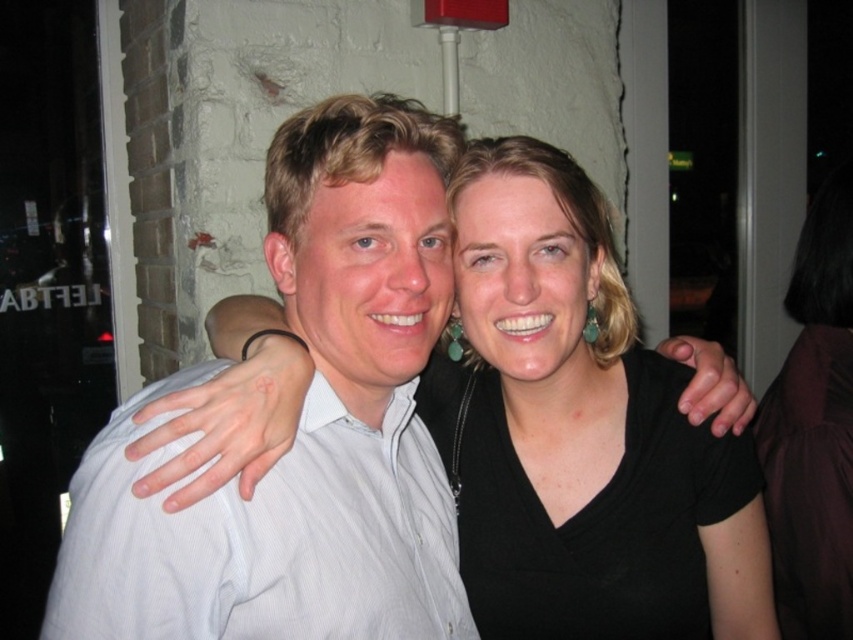
Can you confirm if black matte shirt at center is positioned to the right of black fabric at right?

Incorrect, black matte shirt at center is not on the right side of black fabric at right.

Who is more distant from viewer, (x=637, y=445) or (x=844, y=332)?

Positioned behind is point (x=844, y=332).

Is point (573, 330) farther from viewer compared to point (781, 540)?

That is False.

The height and width of the screenshot is (640, 853). I want to click on black matte shirt at center, so click(567, 420).

This screenshot has height=640, width=853. What do you see at coordinates (305, 422) in the screenshot? I see `white striped shirt at left` at bounding box center [305, 422].

At what (x,y) coordinates should I click in order to perform the action: click on white striped shirt at left. Please return your answer as a coordinate pair (x, y). The height and width of the screenshot is (640, 853). Looking at the image, I should click on (305, 422).

Is point (425, 122) more distant than point (589, 376)?

That is False.

What are the coordinates of `white striped shirt at left` in the screenshot? It's located at (305, 422).

Is white striped shirt at left below black fabric at right?

Incorrect, white striped shirt at left is not positioned below black fabric at right.

Is white striped shirt at left above black fabric at right?

Indeed, white striped shirt at left is positioned over black fabric at right.

The height and width of the screenshot is (640, 853). I want to click on white striped shirt at left, so click(305, 422).